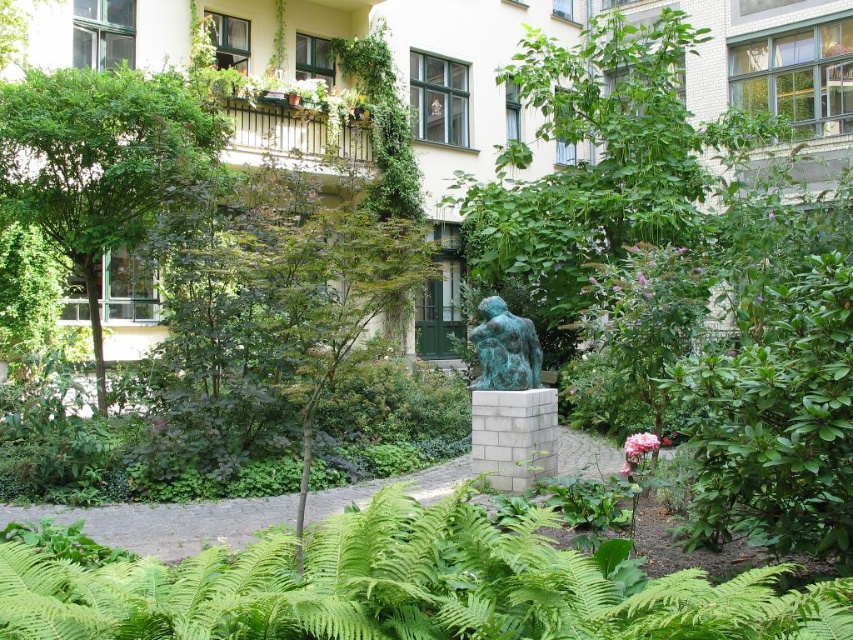
You are a gardener who wants to plant a new flower bed between the green leafy fern at lower center and the green patina statue at center. Considering their heights, which object should you place the flower bed closer to?

The flower bed should be placed closer to the green leafy fern at lower center because it has a lesser height compared to the green patina statue at center, allowing better visibility and sunlight access.